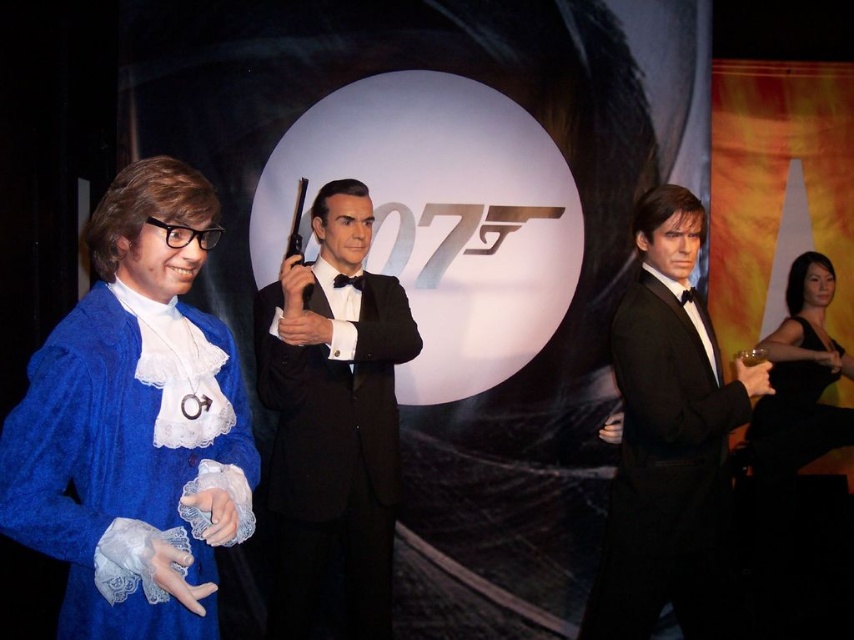
Question: Which object is closer to the camera taking this photo?

Choices:
 (A) shiny black tuxedo at right
 (B) black glossy tuxedo at center
 (C) black satin dress at right
 (D) blue velvet dress at left

Answer: (D)

Question: Is shiny black tuxedo at right closer to the viewer compared to black satin dress at right?

Choices:
 (A) yes
 (B) no

Answer: (A)

Question: Considering the real-world distances, which object is farthest from the black satin dress at right?

Choices:
 (A) shiny black tuxedo at right
 (B) black glossy tuxedo at center
 (C) blue velvet dress at left
 (D) shiny silver gun at center

Answer: (C)

Question: From the image, what is the correct spatial relationship of black glossy tuxedo at center in relation to shiny silver gun at center?

Choices:
 (A) below
 (B) above

Answer: (A)

Question: Which point is farther from the camera taking this photo?

Choices:
 (A) (757, 385)
 (B) (141, 452)

Answer: (A)

Question: Can you confirm if blue velvet dress at left is bigger than black satin dress at right?

Choices:
 (A) yes
 (B) no

Answer: (B)